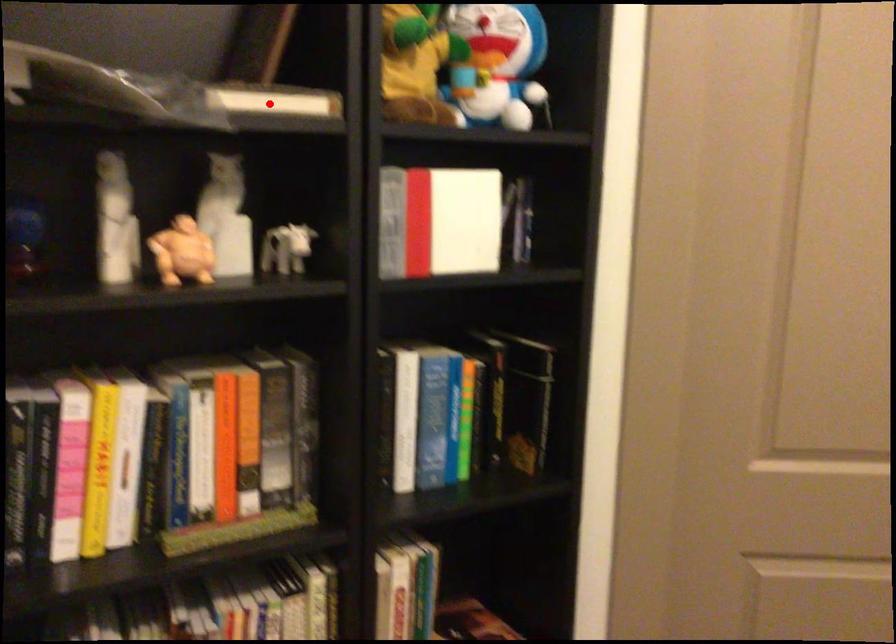
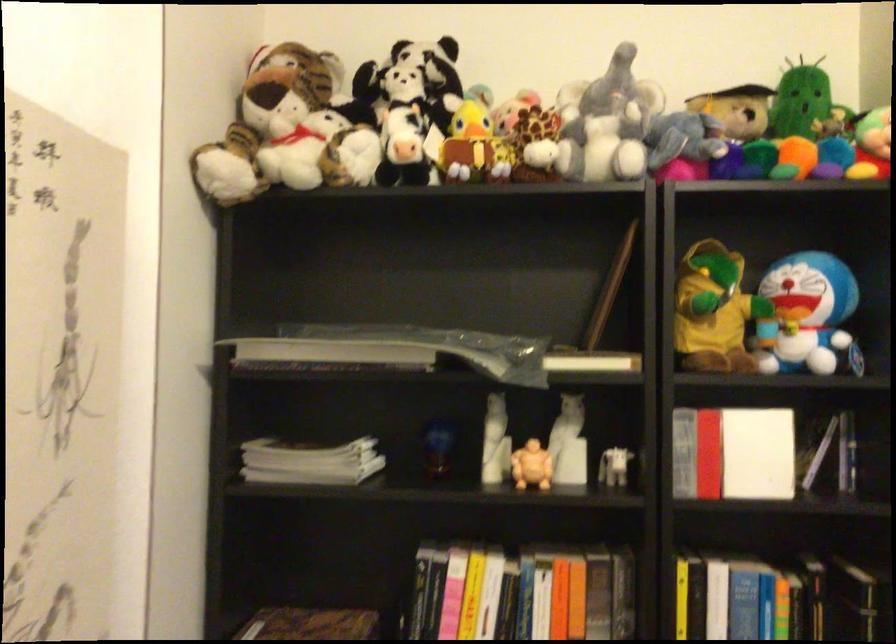
In the second image, find the point that corresponds to the highlighted location in the first image.

(591, 361)